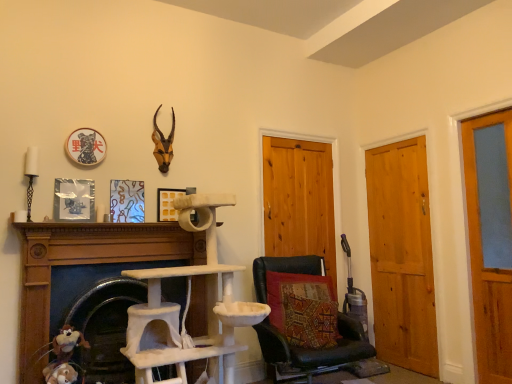
You are a GUI agent. You are given a task and a screenshot of the screen. Output one action in this format:
    pyautogui.click(x=<x>, y=<y>)
    Task: Click on the brown matte antlers at upper center
    This screenshot has width=512, height=384.
    Given the screenshot: What is the action you would take?
    pyautogui.click(x=163, y=144)

What do you see at coordinates (163, 144) in the screenshot? The height and width of the screenshot is (384, 512). I see `brown matte antlers at upper center` at bounding box center [163, 144].

This screenshot has width=512, height=384. In order to click on wooden door at right, which is the 3th door from left to right in this screenshot , I will do `click(490, 239)`.

Where is `beige felt cat tree at lower left, the second fireplace in the left-to-right sequence`? This screenshot has width=512, height=384. beige felt cat tree at lower left, the second fireplace in the left-to-right sequence is located at coordinates (105, 328).

I want to click on light brown wood door at right, marked as the second door in a left-to-right arrangement, so click(402, 256).

Describe the element at coordinates (319, 353) in the screenshot. This screenshot has height=384, width=512. I see `black leather chair at lower center` at that location.

Identify the location of yellow matte picture frame at center, marked as the 2th picture frame in a left-to-right arrangement. The width and height of the screenshot is (512, 384). (167, 204).

Based on the photo, is brown matte antlers at upper center situated inside black leather chair at lower center or outside?

brown matte antlers at upper center is not enclosed by black leather chair at lower center.

Which object is thinner, brown matte antlers at upper center or black leather chair at lower center?

brown matte antlers at upper center.

Does point (169, 157) lie in front of point (269, 336)?

No, it is not.

From a real-world perspective, which is physically above, brown matte antlers at upper center or black leather chair at lower center?

In real-world perspective, brown matte antlers at upper center is above.

Which object is more forward, wooden door at center, the third door in the right-to-left sequence, or textured fabric pillow at center?

textured fabric pillow at center is more forward.

Between wooden door at center, the third door in the right-to-left sequence, and textured fabric pillow at center, which one has larger width?

Wider between the two is textured fabric pillow at center.

In the scene shown: From a real-world perspective, is wooden door at center, the third door in the right-to-left sequence, on textured fabric pillow at center?

Yes, from a real-world perspective, wooden door at center, the third door in the right-to-left sequence, is above textured fabric pillow at center.

Between point (308, 216) and point (288, 327), which one is positioned behind?

The point (308, 216) is more distant.

Which is in front, point (118, 247) or point (71, 190)?

Positioned in front is point (71, 190).

Is white textured cat tree at center, which ranks as the 2th fireplace in right-to-left order, further to camera compared to metallic silver picture frame at left, the 2th picture frame positioned from the right?

No, it is not.

Consider the image. Which of these two, white textured cat tree at center, which ranks as the 2th fireplace in right-to-left order, or metallic silver picture frame at left, the 2th picture frame positioned from the right, stands taller?

white textured cat tree at center, which ranks as the 2th fireplace in right-to-left order.

From the image's perspective, is white textured cat tree at center, the first fireplace viewed from the left, below metallic silver picture frame at left, arranged as the 1th picture frame when viewed from the front?

Yes, from the image's perspective, white textured cat tree at center, the first fireplace viewed from the left, is below metallic silver picture frame at left, arranged as the 1th picture frame when viewed from the front.

Considering the relative sizes of black leather chair at lower center and brown matte antlers at upper center in the image provided, is black leather chair at lower center shorter than brown matte antlers at upper center?

No.

In the scene shown: From a real-world perspective, is black leather chair at lower center above or below brown matte antlers at upper center?

black leather chair at lower center is situated lower than brown matte antlers at upper center in the real world.

Based on their positions, is black leather chair at lower center located to the left or right of brown matte antlers at upper center?

In the image, black leather chair at lower center appears on the right side of brown matte antlers at upper center.

Is black leather chair at lower center surrounding brown matte antlers at upper center?

No, brown matte antlers at upper center is not surrounded by black leather chair at lower center.

From the image's perspective, is textured fabric pillow at center located above or below beige felt cat tree at lower left, the 1th fireplace from the right?

From the image's perspective, textured fabric pillow at center appears above beige felt cat tree at lower left, the 1th fireplace from the right.

From a real-world perspective, which is physically below, textured fabric pillow at center or beige felt cat tree at lower left, the 1th fireplace from the right?

beige felt cat tree at lower left, the 1th fireplace from the right, from a real-world perspective.

Is textured fabric pillow at center taller than beige felt cat tree at lower left, the 1th fireplace from the right?

In fact, textured fabric pillow at center may be shorter than beige felt cat tree at lower left, the 1th fireplace from the right.

Does yellow matte picture frame at center, which is the first picture frame in back-to-front order, turn towards wooden door at right, positioned as the 1th door in right-to-left order?

No, yellow matte picture frame at center, which is the first picture frame in back-to-front order, does not turn towards wooden door at right, positioned as the 1th door in right-to-left order.

Considering the relative sizes of yellow matte picture frame at center, which is the first picture frame in back-to-front order, and wooden door at right, positioned as the 1th door in right-to-left order, in the image provided, is yellow matte picture frame at center, which is the first picture frame in back-to-front order, taller than wooden door at right, positioned as the 1th door in right-to-left order,?

No, yellow matte picture frame at center, which is the first picture frame in back-to-front order, is not taller than wooden door at right, positioned as the 1th door in right-to-left order.

From a real-world perspective, is yellow matte picture frame at center, which is the first picture frame in back-to-front order, below wooden door at right, positioned as the 1th door in right-to-left order?

No, from a real-world perspective, yellow matte picture frame at center, which is the first picture frame in back-to-front order, is not below wooden door at right, positioned as the 1th door in right-to-left order.

Considering the relative positions of fuzzy fabric stuffed animal at lower left and light brown wood door at right, which ranks as the second door in right-to-left order, in the image provided, is fuzzy fabric stuffed animal at lower left to the left of light brown wood door at right, which ranks as the second door in right-to-left order, from the viewer's perspective?

Yes, fuzzy fabric stuffed animal at lower left is to the left of light brown wood door at right, which ranks as the second door in right-to-left order.

Identify the location of the 2nd door to the right of the fuzzy fabric stuffed animal at lower left, starting your count from the anchor. (402, 256).

Between point (66, 328) and point (397, 186), which one is positioned in front?

The point (66, 328) is closer to the camera.

Consider the image. Is fuzzy fabric stuffed animal at lower left placed right next to light brown wood door at right, marked as the second door in a left-to-right arrangement?

No.

The height and width of the screenshot is (384, 512). Find the location of `animal on the left of black leather chair at lower center`. animal on the left of black leather chair at lower center is located at coordinates (163, 144).

Image resolution: width=512 pixels, height=384 pixels. What are the coordinates of `pillow below the wooden door at center, acting as the first door starting from the left (from the image's perspective)` in the screenshot? It's located at (303, 309).

Looking at the image, which one is located closer to black leather chair at lower center, light brown wood door at right, which ranks as the second door in right-to-left order, or yellow matte picture frame at center, which ranks as the second picture frame in front-to-back order?

light brown wood door at right, which ranks as the second door in right-to-left order.

When comparing their distances from yellow matte picture frame at center, which ranks as the second picture frame in front-to-back order, does beige felt cat tree at lower left, the 1th fireplace from the right, or brown matte antlers at upper center seem further?

beige felt cat tree at lower left, the 1th fireplace from the right, is positioned further to the anchor yellow matte picture frame at center, which ranks as the second picture frame in front-to-back order.

Based on the photo, which object lies further to the anchor point wooden door at right, which is the 3th door from left to right, white textured cat tree at center, the first fireplace viewed from the left, or fuzzy fabric stuffed animal at lower left?

fuzzy fabric stuffed animal at lower left.

Estimate the real-world distances between objects in this image. Which object is closer to light brown wood door at right, marked as the second door in a left-to-right arrangement, black leather chair at lower center or yellow matte picture frame at center, marked as the 2th picture frame in a left-to-right arrangement?

black leather chair at lower center lies closer to light brown wood door at right, marked as the second door in a left-to-right arrangement, than the other object.

Estimate the real-world distances between objects in this image. Which object is closer to black leather chair at lower center, fuzzy fabric stuffed animal at lower left or textured fabric pillow at center?

textured fabric pillow at center is positioned closer to the anchor black leather chair at lower center.

From the image, which object appears to be farther from wooden door at center, acting as the first door starting from the left, beige felt cat tree at lower left, the 1th fireplace from the right, or white textured cat tree at center, which ranks as the 2th fireplace in right-to-left order?

beige felt cat tree at lower left, the 1th fireplace from the right, lies further to wooden door at center, acting as the first door starting from the left, than the other object.

Which object lies nearer to the anchor point yellow matte picture frame at center, which is the first picture frame in back-to-front order, wooden door at center, the third door in the right-to-left sequence, or white textured cat tree at center, which ranks as the 2th fireplace in right-to-left order?

Among the two, white textured cat tree at center, which ranks as the 2th fireplace in right-to-left order, is located nearer to yellow matte picture frame at center, which is the first picture frame in back-to-front order.

From the image, which object appears to be farther from white textured cat tree at center, which ranks as the 2th fireplace in right-to-left order, brown matte antlers at upper center or black leather chair at lower center?

black leather chair at lower center.

The height and width of the screenshot is (384, 512). In order to click on picture frame between metallic silver picture frame at left, arranged as the 1th picture frame when viewed from the left, and black leather chair at lower center in this screenshot , I will do `click(167, 204)`.

At what (x,y) coordinates should I click in order to perform the action: click on pillow between black leather chair at lower center and wooden door at center, acting as the first door starting from the left, in the front-back direction. Please return your answer as a coordinate pair (x, y). The height and width of the screenshot is (384, 512). Looking at the image, I should click on (303, 309).

Where is `door between wooden door at center, the third door in the right-to-left sequence, and wooden door at right, positioned as the 1th door in right-to-left order`? This screenshot has height=384, width=512. door between wooden door at center, the third door in the right-to-left sequence, and wooden door at right, positioned as the 1th door in right-to-left order is located at coordinates (402, 256).

Identify the location of picture frame located between brown matte antlers at upper center and wooden door at right, positioned as the 1th door in right-to-left order, in the left-right direction. The height and width of the screenshot is (384, 512). (167, 204).